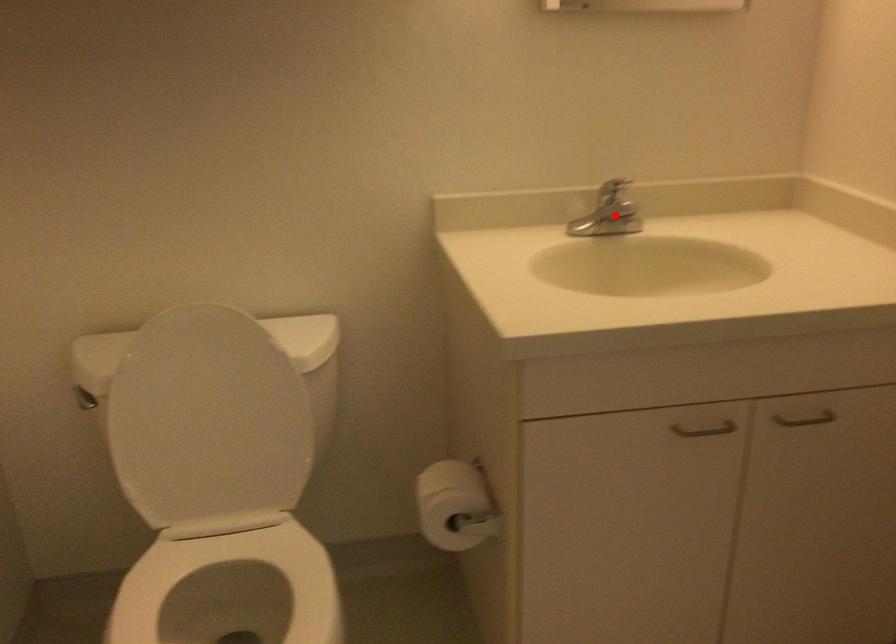
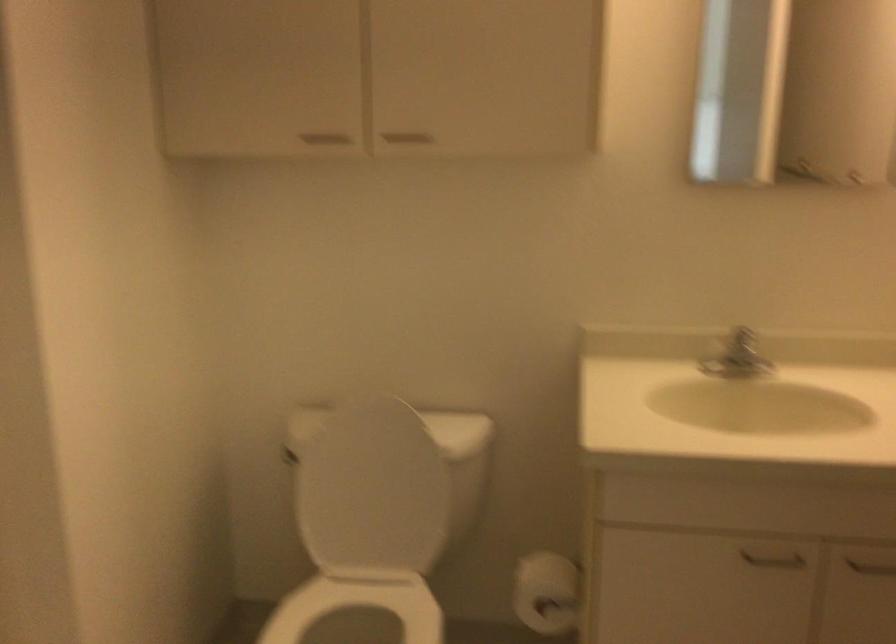
Where in the second image is the point corresponding to the highlighted location from the first image?

(737, 357)